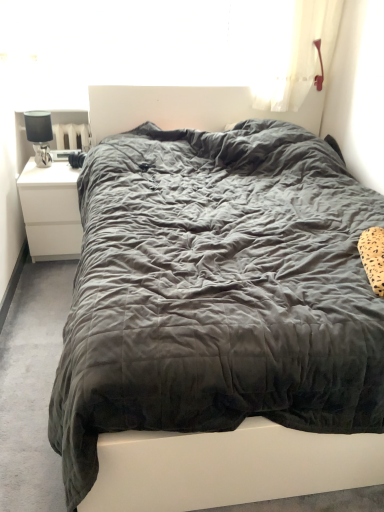
Question: Is satin black lamp at left surrounded by white matte nightstand at left?

Choices:
 (A) yes
 (B) no

Answer: (B)

Question: Can you confirm if white matte nightstand at left is smaller than satin black lamp at left?

Choices:
 (A) no
 (B) yes

Answer: (A)

Question: Does white matte nightstand at left have a lesser height compared to satin black lamp at left?

Choices:
 (A) yes
 (B) no

Answer: (B)

Question: Is white matte nightstand at left facing away from satin black lamp at left?

Choices:
 (A) no
 (B) yes

Answer: (A)

Question: Considering the relative sizes of white matte nightstand at left and satin black lamp at left in the image provided, is white matte nightstand at left taller than satin black lamp at left?

Choices:
 (A) yes
 (B) no

Answer: (A)

Question: Is white matte nightstand at left not within satin black lamp at left?

Choices:
 (A) no
 (B) yes

Answer: (B)

Question: From the image's perspective, is white matte nightstand at left on top of dark grey quilted bed at center?

Choices:
 (A) yes
 (B) no

Answer: (A)

Question: Is white matte nightstand at left shorter than dark grey quilted bed at center?

Choices:
 (A) no
 (B) yes

Answer: (B)

Question: Is the position of white matte nightstand at left less distant than that of dark grey quilted bed at center?

Choices:
 (A) yes
 (B) no

Answer: (B)

Question: Is dark grey quilted bed at center completely or partially inside white matte nightstand at left?

Choices:
 (A) no
 (B) yes

Answer: (A)

Question: Are white matte nightstand at left and dark grey quilted bed at center beside each other?

Choices:
 (A) yes
 (B) no

Answer: (B)

Question: Can you confirm if white matte nightstand at left is positioned to the right of dark grey quilted bed at center?

Choices:
 (A) no
 (B) yes

Answer: (A)

Question: Can you confirm if satin black lamp at left is positioned to the left of dark grey quilted bed at center?

Choices:
 (A) yes
 (B) no

Answer: (A)